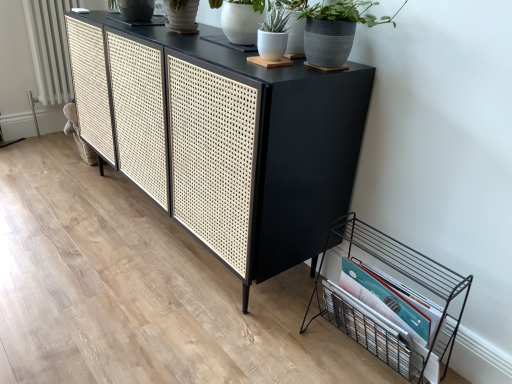
In order to click on vacant space underneath black wire magazine rack at lower right (from a real-world perspective) in this screenshot , I will do `click(352, 352)`.